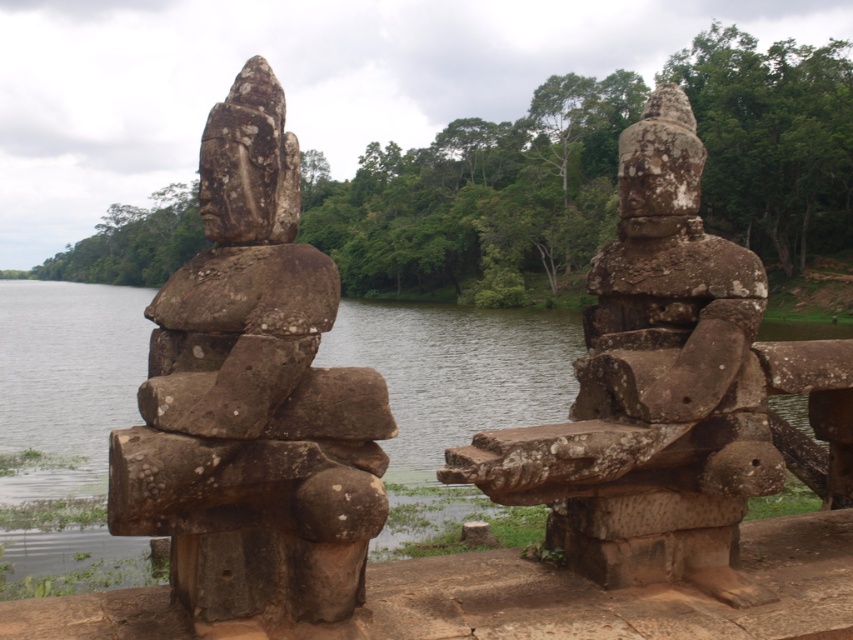
Question: Which point is farther to the camera?

Choices:
 (A) (260, 540)
 (B) (709, 356)

Answer: (B)

Question: Which point is closer to the camera?

Choices:
 (A) rusty stone statue at center
 (B) green mossy water at center
 (C) rusty stone statue at left

Answer: (C)

Question: Which object appears closest to the camera in this image?

Choices:
 (A) green mossy water at center
 (B) rusty stone statue at center

Answer: (A)

Question: Is rusty stone statue at center above green mossy water at center?

Choices:
 (A) yes
 (B) no

Answer: (B)

Question: Does rusty stone statue at left come in front of rusty stone statue at center?

Choices:
 (A) no
 (B) yes

Answer: (B)

Question: Does rusty stone statue at center have a larger size compared to green mossy water at center?

Choices:
 (A) yes
 (B) no

Answer: (B)